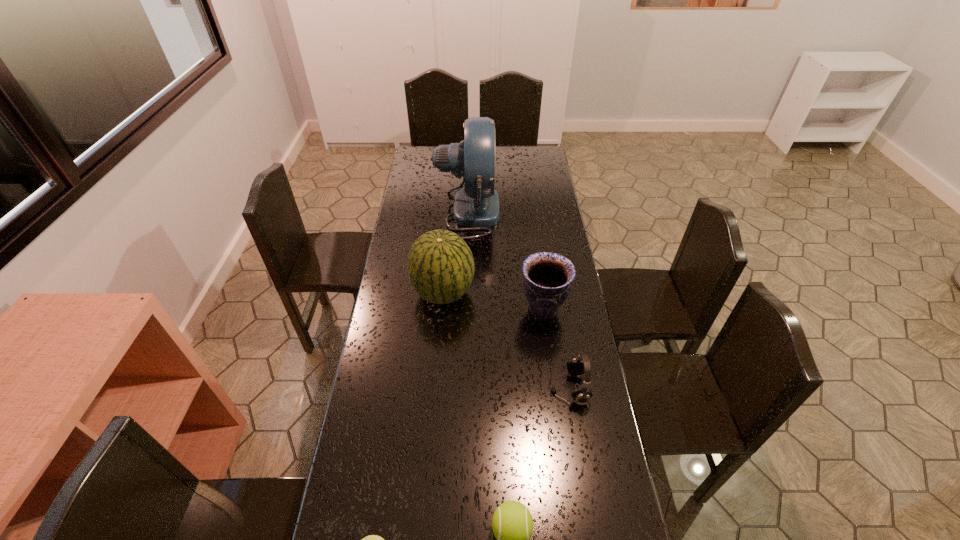
Locate an element on the screen. the tallest object is located at coordinates (476, 205).

This screenshot has height=540, width=960. Find the location of `fan`. fan is located at coordinates (476, 205).

The width and height of the screenshot is (960, 540). Identify the location of watermelon. (440, 265).

I want to click on pottery, so click(547, 279).

Locate an element on the screen. This screenshot has width=960, height=540. the fourth farthest object is located at coordinates (579, 365).

Locate an element on the screen. The height and width of the screenshot is (540, 960). headset is located at coordinates (579, 365).

You are a GUI agent. You are given a task and a screenshot of the screen. Output one action in this format:
    pyautogui.click(x=<x>, y=<y>)
    Task: Click on the vacant space located in front of the tallest object to blow air
    
    Given the screenshot: What is the action you would take?
    pyautogui.click(x=530, y=212)

Where is `free space located on the right of the fifth shortest object`? The height and width of the screenshot is (540, 960). free space located on the right of the fifth shortest object is located at coordinates (562, 293).

Where is `vacant area situated on the front handle of the fourth shortest object`? This screenshot has width=960, height=540. vacant area situated on the front handle of the fourth shortest object is located at coordinates (489, 309).

This screenshot has width=960, height=540. Identify the location of free region located 0.190m on the front handle of the fourth shortest object. (468, 309).